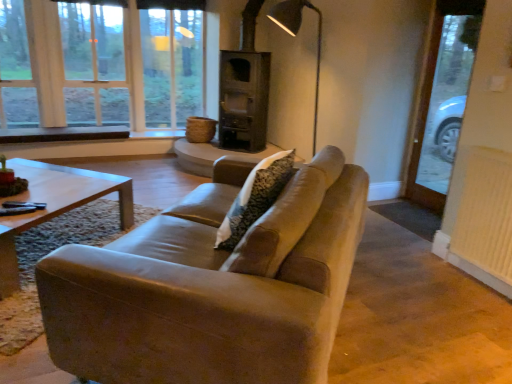
Question: Can clear glass window at upper left be found inside leather couch at center?

Choices:
 (A) yes
 (B) no

Answer: (B)

Question: Does leather couch at center have a smaller size compared to clear glass window at upper left?

Choices:
 (A) yes
 (B) no

Answer: (B)

Question: Is leather couch at center positioned in front of clear glass window at upper left?

Choices:
 (A) no
 (B) yes

Answer: (B)

Question: From the image's perspective, does leather couch at center appear lower than clear glass window at upper left?

Choices:
 (A) no
 (B) yes

Answer: (B)

Question: Can you confirm if leather couch at center is positioned to the left of clear glass window at upper left?

Choices:
 (A) no
 (B) yes

Answer: (A)

Question: Is leather couch at center outside clear glass window at upper left?

Choices:
 (A) no
 (B) yes

Answer: (B)

Question: Is clear glass door at right at the left side of white textured radiator at right?

Choices:
 (A) no
 (B) yes

Answer: (A)

Question: Is clear glass door at right closer to the viewer compared to white textured radiator at right?

Choices:
 (A) no
 (B) yes

Answer: (A)

Question: Can you confirm if clear glass door at right is shorter than white textured radiator at right?

Choices:
 (A) yes
 (B) no

Answer: (B)

Question: From the image's perspective, is clear glass door at right on top of white textured radiator at right?

Choices:
 (A) no
 (B) yes

Answer: (B)

Question: Is clear glass door at right taller than white textured radiator at right?

Choices:
 (A) yes
 (B) no

Answer: (A)

Question: Is there a large distance between clear glass door at right and white textured radiator at right?

Choices:
 (A) yes
 (B) no

Answer: (A)

Question: Is clear glass door at right in contact with metallic gray floor lamp at upper center?

Choices:
 (A) yes
 (B) no

Answer: (B)